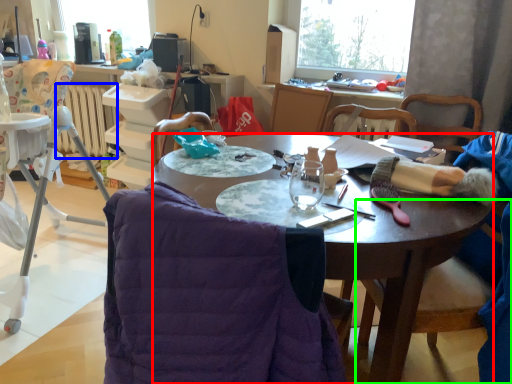
Question: Based on their relative distances, which object is nearer to desk (highlighted by a red box)? Choose from radiator (highlighted by a blue box) and chair (highlighted by a green box).

Choices:
 (A) radiator
 (B) chair

Answer: (B)